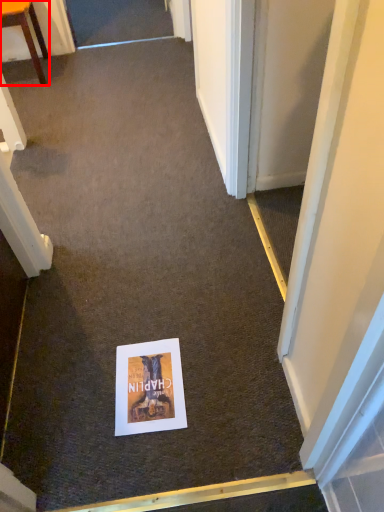
Question: From the image's perspective, considering the relative positions of furniture (annotated by the red box) and poster page in the image provided, where is furniture (annotated by the red box) located with respect to the staircase?

Choices:
 (A) below
 (B) above

Answer: (B)